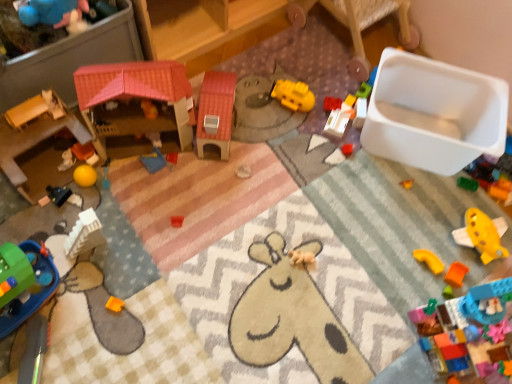
Find the location of `free space behind yellow plastic airplane at lower right, arranged as the 15th toy when viewed from the left`. free space behind yellow plastic airplane at lower right, arranged as the 15th toy when viewed from the left is located at coordinates (458, 197).